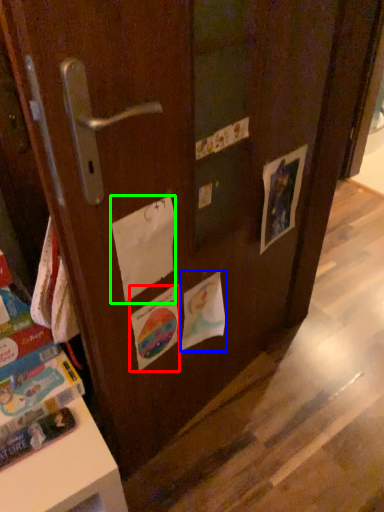
Question: Which is farther away from flyer (highlighted by a red box)? flyer (highlighted by a blue box) or paper (highlighted by a green box)?

Choices:
 (A) flyer
 (B) paper

Answer: (B)